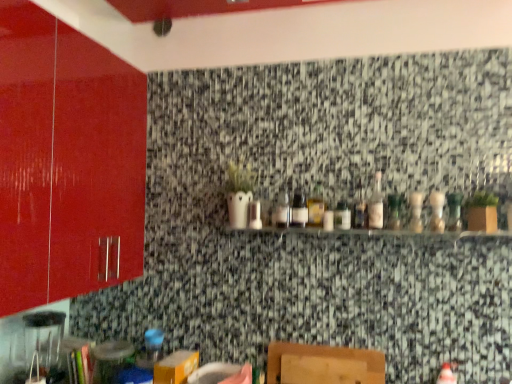
Image resolution: width=512 pixels, height=384 pixels. I want to click on clear glass bottle at right, the 9th bottle from the left, so click(x=454, y=211).

At what (x,y) coordinates should I click in order to perform the action: click on translucent glass bottle at center, marked as the 1th bottle in a left-to-right arrangement. Please return your answer as a coordinate pair (x, y). The height and width of the screenshot is (384, 512). Looking at the image, I should click on (298, 210).

Describe the element at coordinates (437, 211) in the screenshot. I see `clear glass bottle at center, which ranks as the 2th bottle in right-to-left order` at that location.

This screenshot has width=512, height=384. What do you see at coordinates (371, 233) in the screenshot? I see `clear glass shelf at center` at bounding box center [371, 233].

I want to click on clear glass shelf at center, so pos(371,233).

Locate an element on the screen. Image resolution: width=512 pixels, height=384 pixels. translucent glass bottle at center, arranged as the eighth bottle when viewed from the right is located at coordinates (316, 206).

What do you see at coordinates (416, 211) in the screenshot? I see `translucent glass bottle at center, acting as the 7th bottle starting from the left` at bounding box center [416, 211].

Where is `clear glass bottle at center, which appears as the seventh bottle when viewed from the right`? clear glass bottle at center, which appears as the seventh bottle when viewed from the right is located at coordinates (342, 216).

This screenshot has height=384, width=512. I want to click on clear glass bottle at right, the 1th bottle in the right-to-left sequence, so click(x=454, y=211).

Measure the distance from clear glass bottle at center, which ranks as the 5th bottle in left-to-right order, to translucent glass bottle at center, the 2th bottle when ordered from left to right.

The distance of clear glass bottle at center, which ranks as the 5th bottle in left-to-right order, from translucent glass bottle at center, the 2th bottle when ordered from left to right, is 8.00 inches.

Is clear glass bottle at center, which ranks as the 5th bottle in left-to-right order, looking in the opposite direction of translucent glass bottle at center, arranged as the eighth bottle when viewed from the right?

No, clear glass bottle at center, which ranks as the 5th bottle in left-to-right order,'s orientation is not away from translucent glass bottle at center, arranged as the eighth bottle when viewed from the right.

Between point (378, 173) and point (313, 214), which one is positioned behind?

Point (378, 173)

Can you confirm if clear glass bottle at center, which ranks as the 5th bottle in left-to-right order, is bigger than translucent glass bottle at center, the 2th bottle when ordered from left to right?

Yes, clear glass bottle at center, which ranks as the 5th bottle in left-to-right order, is bigger than translucent glass bottle at center, the 2th bottle when ordered from left to right.

From a real-world perspective, is clear glass bottle at center, the fourth bottle when ordered from left to right, located beneath clear glass bottle at center, which appears as the seventh bottle when viewed from the right?

No, from a real-world perspective, clear glass bottle at center, the fourth bottle when ordered from left to right, is not beneath clear glass bottle at center, which appears as the seventh bottle when viewed from the right.

Considering the sizes of objects clear glass bottle at center, the fourth bottle when ordered from left to right, and clear glass bottle at center, which appears as the seventh bottle when viewed from the right, in the image provided, who is thinner, clear glass bottle at center, the fourth bottle when ordered from left to right, or clear glass bottle at center, which appears as the seventh bottle when viewed from the right,?

clear glass bottle at center, the fourth bottle when ordered from left to right.

In the scene shown: Is clear glass bottle at center, the 6th bottle in the right-to-left sequence, positioned beyond the bounds of clear glass bottle at center, which appears as the seventh bottle when viewed from the right?

Absolutely, clear glass bottle at center, the 6th bottle in the right-to-left sequence, is external to clear glass bottle at center, which appears as the seventh bottle when viewed from the right.

Who is shorter, clear glass bottle at center, the 6th bottle in the right-to-left sequence, or clear glass bottle at center, positioned as the third bottle in left-to-right order?

clear glass bottle at center, positioned as the third bottle in left-to-right order.

Can you confirm if clear glass bottle at right, the 9th bottle from the left, is positioned to the right of wooden cutting board at center?

Correct, you'll find clear glass bottle at right, the 9th bottle from the left, to the right of wooden cutting board at center.

Is wooden cutting board at center located within clear glass bottle at right, the 1th bottle in the right-to-left sequence?

No, wooden cutting board at center is not surrounded by clear glass bottle at right, the 1th bottle in the right-to-left sequence.

Is clear glass bottle at right, the 1th bottle in the right-to-left sequence, behind wooden cutting board at center?

That is False.

From a real-world perspective, which object stands above the other?

translucent glass bottle at center, marked as the 1th bottle in a left-to-right arrangement, is physically above.

Measure the distance from wooden cutting board at center to translucent glass bottle at center, which is the ninth bottle in right-to-left order.

A distance of 22.15 inches exists between wooden cutting board at center and translucent glass bottle at center, which is the ninth bottle in right-to-left order.

From the image's perspective, is wooden cutting board at center positioned above or below translucent glass bottle at center, which is the ninth bottle in right-to-left order?

From the image's perspective, wooden cutting board at center appears below translucent glass bottle at center, which is the ninth bottle in right-to-left order.

In the scene shown: Would you say wooden cutting board at center contains translucent glass bottle at center, which is the ninth bottle in right-to-left order?

Actually, translucent glass bottle at center, which is the ninth bottle in right-to-left order, is outside wooden cutting board at center.

Can you tell me how much clear glass bottle at center, which appears as the seventh bottle when viewed from the right, and clear glass bottle at center, which appears as the 8th bottle when viewed from the left, differ in facing direction?

0.000784 degrees separate the facing orientations of clear glass bottle at center, which appears as the seventh bottle when viewed from the right, and clear glass bottle at center, which appears as the 8th bottle when viewed from the left.

Looking at this image, is clear glass bottle at center, which appears as the seventh bottle when viewed from the right, looking in the opposite direction of clear glass bottle at center, which appears as the 8th bottle when viewed from the left?

No, clear glass bottle at center, which appears as the seventh bottle when viewed from the right,'s orientation is not away from clear glass bottle at center, which appears as the 8th bottle when viewed from the left.

From a real-world perspective, which is physically below, clear glass bottle at center, which appears as the seventh bottle when viewed from the right, or clear glass bottle at center, which ranks as the 2th bottle in right-to-left order?

In real-world perspective, clear glass bottle at center, which appears as the seventh bottle when viewed from the right, is lower.

Is clear glass bottle at center, positioned as the third bottle in left-to-right order, positioned behind clear glass bottle at center, which appears as the 8th bottle when viewed from the left?

Yes, clear glass bottle at center, positioned as the third bottle in left-to-right order, is further from the viewer.

What's the angular difference between translucent glass bottle at center, acting as the 7th bottle starting from the left, and translucent glass bottle at center, which is the ninth bottle in right-to-left order,'s facing directions?

They differ by 0.000414 degrees in their facing directions.

Does translucent glass bottle at center, acting as the 7th bottle starting from the left, come in front of translucent glass bottle at center, which is the ninth bottle in right-to-left order?

Yes, translucent glass bottle at center, acting as the 7th bottle starting from the left, is closer to the viewer.

Considering the relative sizes of translucent glass bottle at center, which is counted as the 3th bottle, starting from the right, and translucent glass bottle at center, marked as the 1th bottle in a left-to-right arrangement, in the image provided, is translucent glass bottle at center, which is counted as the 3th bottle, starting from the right, bigger than translucent glass bottle at center, marked as the 1th bottle in a left-to-right arrangement,?

Correct, translucent glass bottle at center, which is counted as the 3th bottle, starting from the right, is larger in size than translucent glass bottle at center, marked as the 1th bottle in a left-to-right arrangement.

From a real-world perspective, is translucent glass bottle at center, acting as the 7th bottle starting from the left, physically below translucent glass bottle at center, marked as the 1th bottle in a left-to-right arrangement?

No, from a real-world perspective, translucent glass bottle at center, acting as the 7th bottle starting from the left, is not below translucent glass bottle at center, marked as the 1th bottle in a left-to-right arrangement.

Which object is wider, clear glass bottle at center, which ranks as the 5th bottle in left-to-right order, or clear glass shelf at center?

clear glass shelf at center is wider.

Which of these two, clear glass bottle at center, the 5th bottle when ordered from right to left, or clear glass shelf at center, is bigger?

clear glass shelf at center is bigger.

This screenshot has width=512, height=384. In order to click on the 5th bottle behind the clear glass shelf at center in this screenshot , I will do `click(376, 204)`.

From a real-world perspective, relative to clear glass shelf at center, is clear glass bottle at center, which ranks as the 5th bottle in left-to-right order, vertically above or below?

clear glass bottle at center, which ranks as the 5th bottle in left-to-right order, is above clear glass shelf at center.

There is a clear glass bottle at center, which ranks as the 5th bottle in left-to-right order. At what (x,y) coordinates should I click in order to perform the action: click on the 6th bottle below it (from a real-world perspective). Please return your answer as a coordinate pair (x, y). This screenshot has height=384, width=512. Looking at the image, I should click on (316, 206).

At what (x,y) coordinates should I click in order to perform the action: click on the 6th bottle above the clear glass bottle at center, positioned as the third bottle in left-to-right order (from the image's perspective). Please return your answer as a coordinate pair (x, y). This screenshot has width=512, height=384. Looking at the image, I should click on (359, 208).

Considering their positions, is green glass bottle at center, the 6th bottle viewed from the left, positioned further to translucent glass bottle at center, the 2th bottle when ordered from left to right, than clear glass bottle at center, positioned as the third bottle in left-to-right order?

green glass bottle at center, the 6th bottle viewed from the left, is positioned further to the anchor translucent glass bottle at center, the 2th bottle when ordered from left to right.

From the image, which object appears to be farther from clear glass bottle at center, which ranks as the 2th bottle in right-to-left order, clear glass shelf at center or green glass bottle at center, the 6th bottle viewed from the left?

The object further to clear glass bottle at center, which ranks as the 2th bottle in right-to-left order, is clear glass shelf at center.

Which object lies nearer to the anchor point clear glass bottle at center, positioned as the third bottle in left-to-right order, wooden cutting board at center or clear glass bottle at center, the fourth bottle when ordered from left to right?

clear glass bottle at center, the fourth bottle when ordered from left to right, is positioned closer to the anchor clear glass bottle at center, positioned as the third bottle in left-to-right order.

Estimate the real-world distances between objects in this image. Which object is closer to clear glass bottle at center, which appears as the 8th bottle when viewed from the left, clear glass shelf at center or clear glass bottle at right, the 1th bottle in the right-to-left sequence?

Based on the image, clear glass bottle at right, the 1th bottle in the right-to-left sequence, appears to be nearer to clear glass bottle at center, which appears as the 8th bottle when viewed from the left.

Looking at the image, which one is located closer to clear glass bottle at center, the 5th bottle when ordered from right to left, clear glass bottle at center, the fourth bottle when ordered from left to right, or clear glass bottle at right, the 1th bottle in the right-to-left sequence?

Among the two, clear glass bottle at center, the fourth bottle when ordered from left to right, is located nearer to clear glass bottle at center, the 5th bottle when ordered from right to left.

Which object lies nearer to the anchor point clear glass bottle at center, the 6th bottle in the right-to-left sequence, translucent glass bottle at center, which is counted as the 3th bottle, starting from the right, or translucent glass bottle at center, the 2th bottle when ordered from left to right?

translucent glass bottle at center, the 2th bottle when ordered from left to right, lies closer to clear glass bottle at center, the 6th bottle in the right-to-left sequence, than the other object.

Which object lies nearer to the anchor point translucent glass bottle at center, the 2th bottle when ordered from left to right, clear glass bottle at right, the 9th bottle from the left, or clear glass bottle at center, which appears as the seventh bottle when viewed from the right?

clear glass bottle at center, which appears as the seventh bottle when viewed from the right, is positioned closer to the anchor translucent glass bottle at center, the 2th bottle when ordered from left to right.

Looking at the image, which one is located closer to clear glass bottle at center, the 6th bottle in the right-to-left sequence, translucent glass bottle at center, acting as the 7th bottle starting from the left, or clear glass bottle at center, positioned as the third bottle in left-to-right order?

Based on the image, clear glass bottle at center, positioned as the third bottle in left-to-right order, appears to be nearer to clear glass bottle at center, the 6th bottle in the right-to-left sequence.

Locate an element on the screen. bottle located between clear glass bottle at center, which appears as the seventh bottle when viewed from the right, and clear glass bottle at center, which ranks as the 5th bottle in left-to-right order, in the left-right direction is located at coordinates (359, 208).

You are a GUI agent. You are given a task and a screenshot of the screen. Output one action in this format:
    pyautogui.click(x=<x>, y=<y>)
    Task: Click on the shelf between translucent glass bottle at center, the 2th bottle when ordered from left to right, and wooden cutting board at center in the up-down direction
    
    Given the screenshot: What is the action you would take?
    pyautogui.click(x=371, y=233)

The image size is (512, 384). In order to click on bottle between clear glass bottle at center, which appears as the seventh bottle when viewed from the right, and wooden cutting board at center from top to bottom in this screenshot , I will do `click(298, 210)`.

What are the coordinates of `shelf between clear glass bottle at center, the 6th bottle in the right-to-left sequence, and wooden cutting board at center from top to bottom` in the screenshot? It's located at (371, 233).